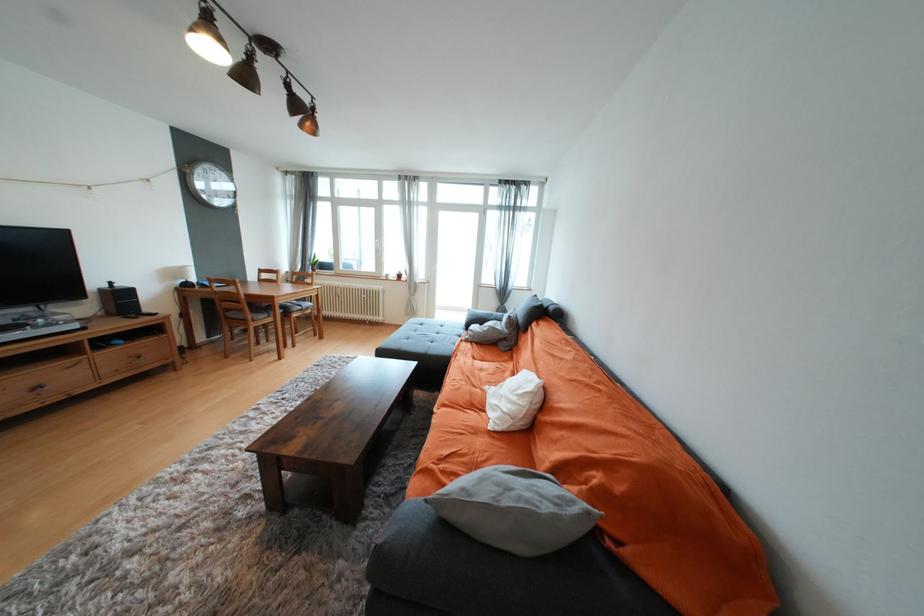
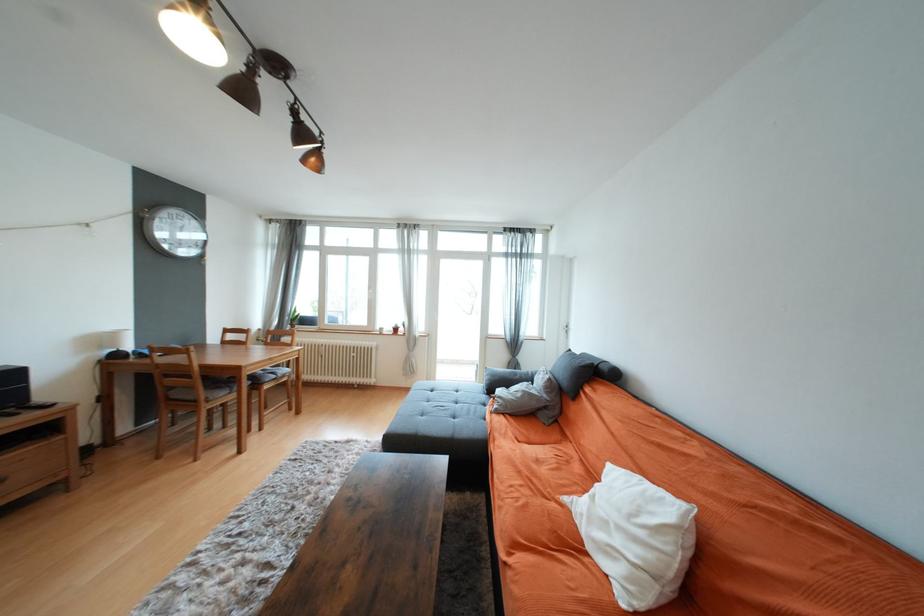
In the second image, find the point that corresponds to [146,358] in the first image.

(7, 482)